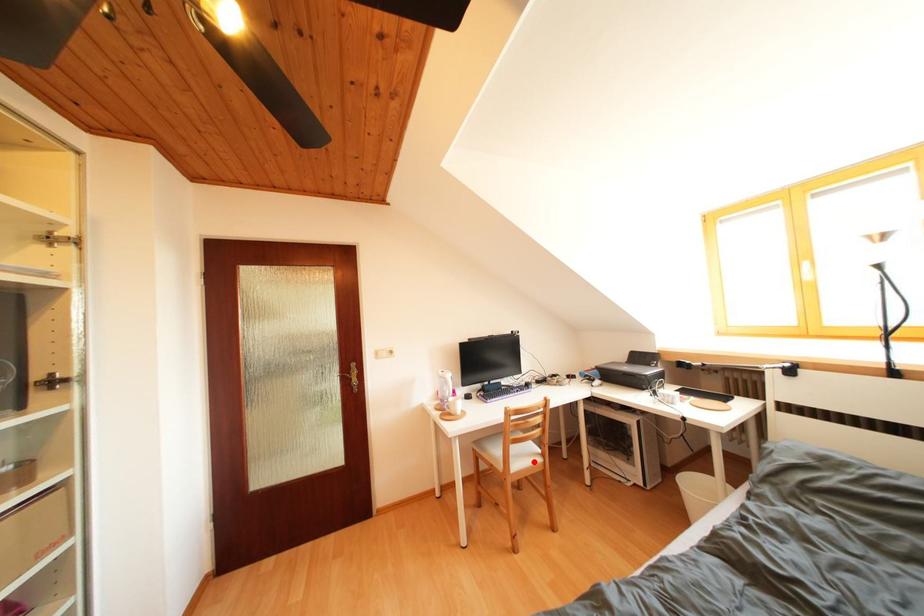
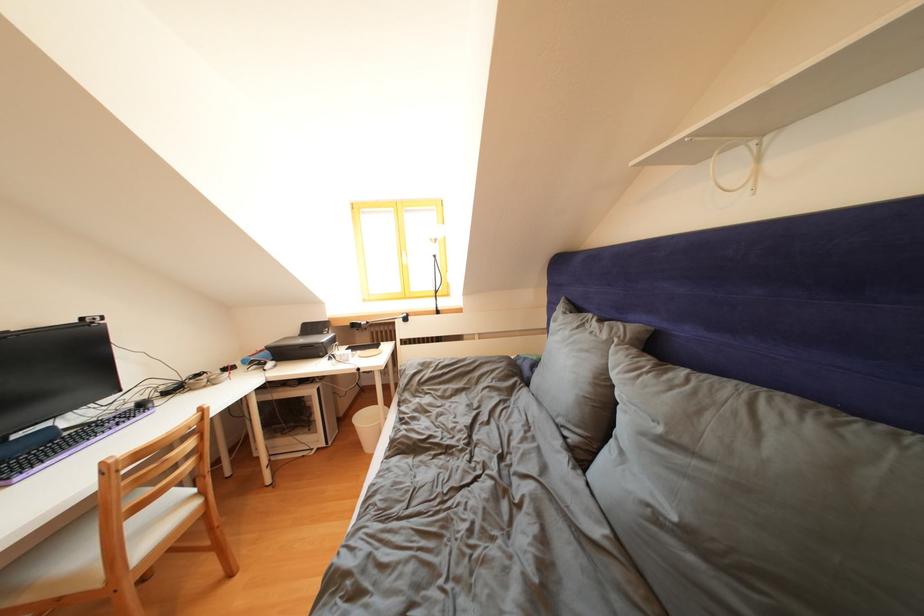
The point at the highlighted location is marked in the first image. Where is the corresponding point in the second image?

(175, 522)